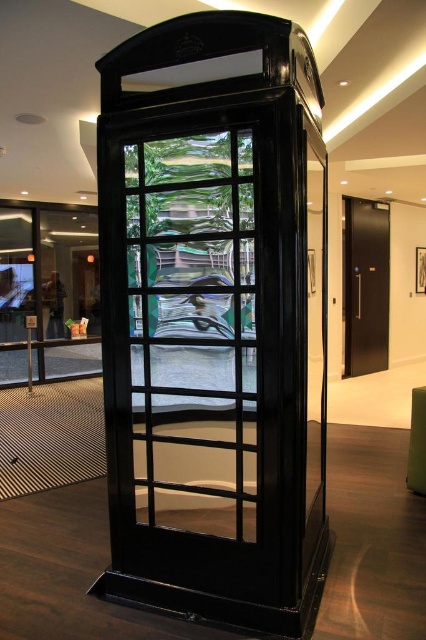
Question: Which object is closer to the camera taking this photo?

Choices:
 (A) clear glass door at center
 (B) black metal elevator at right

Answer: (A)

Question: Among these objects, which one is farthest from the camera?

Choices:
 (A) black metal elevator at right
 (B) clear glass door at center

Answer: (A)

Question: Can you confirm if clear glass door at center is positioned below black metal elevator at right?

Choices:
 (A) yes
 (B) no

Answer: (A)

Question: Is clear glass door at center behind black metal elevator at right?

Choices:
 (A) yes
 (B) no

Answer: (B)

Question: Which point is closer to the camera?

Choices:
 (A) clear glass door at center
 (B) black metal elevator at right

Answer: (A)

Question: Can you confirm if clear glass door at center is positioned above black metal elevator at right?

Choices:
 (A) yes
 (B) no

Answer: (B)